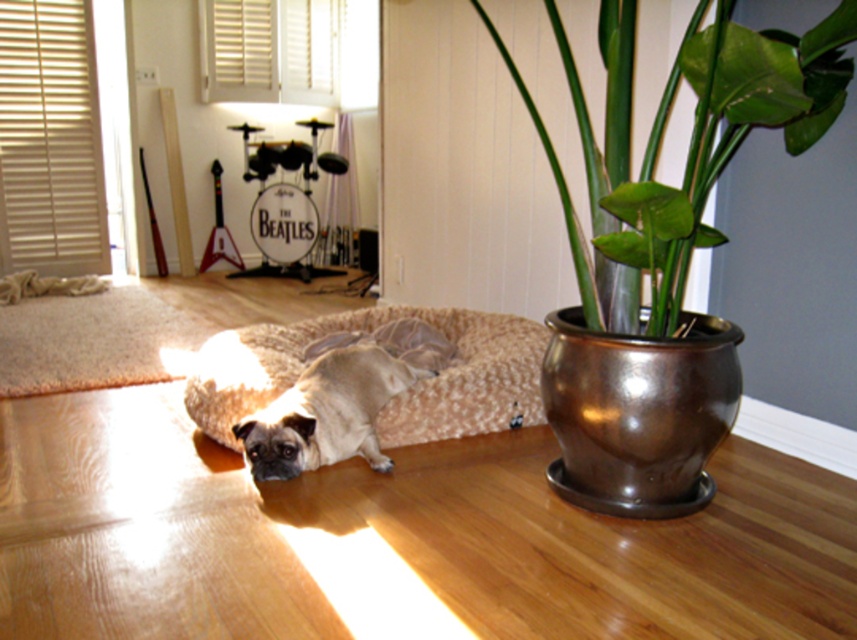
Based on the scene description, where is the beige plush dog bed located? Please provide coordinates in the format of a point like point (393, 400).

The beige plush dog bed at center is located at point (393, 400).